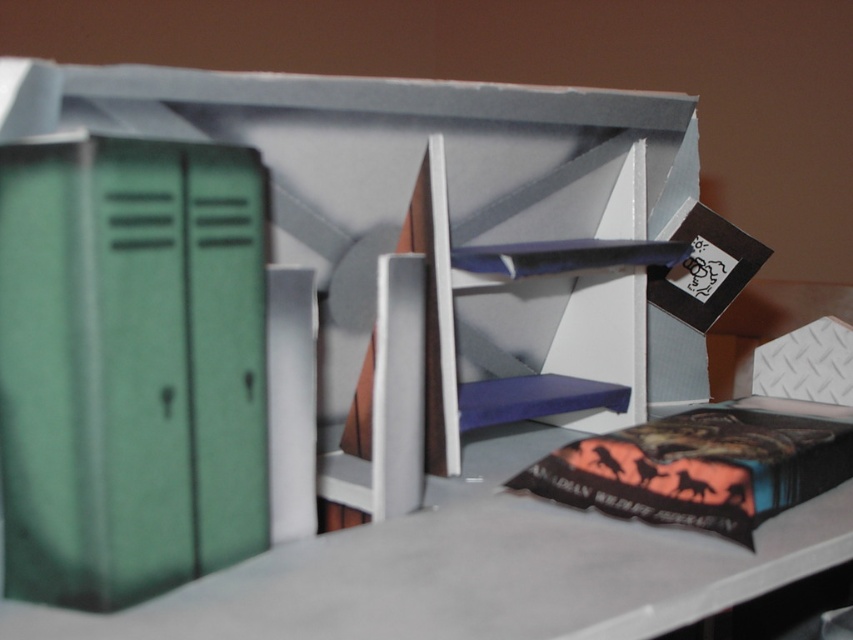
Consider the image. You are a student in the hallway and need to reach the brown door behind the column. You see the matte black book at center and the green matte locker at left. Which object is closer to the column?

The matte black book at center is closer to the column because it is positioned to the right of the green matte locker at left, which is further away from the column.

You are a student trying to place your orange matte book at lower right on top of the green matte locker at left. Based on their sizes, will the book fit on the locker without hanging off the edges?

The green matte locker at left has a greater height compared to the orange matte book at lower right, so the book will fit on the locker without hanging off the edges since it is shorter in height.

You are a student in the hallway and need to place your matte black book at center onto the green matte locker at left. Can you do this without moving the locker?

The matte black book at center is located above the green matte locker at left, so you can place it directly onto the locker without moving it.